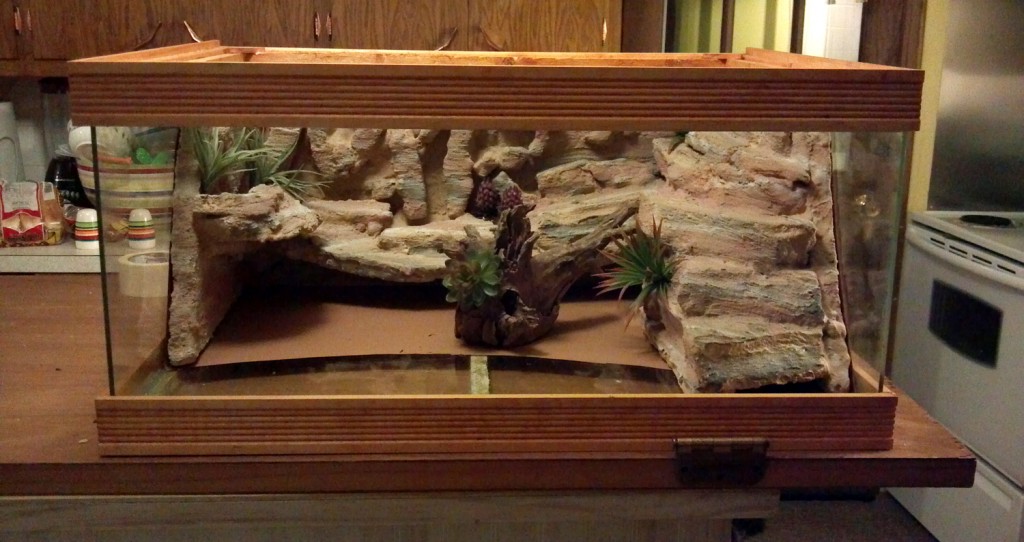
I want to click on wooden counter, so click(46, 378).